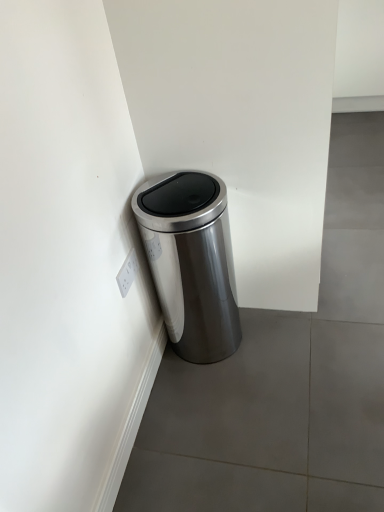
Question: Does satin silver trash can at corner have a greater width compared to white plastic electric outlet at lower left?

Choices:
 (A) no
 (B) yes

Answer: (B)

Question: Does satin silver trash can at corner have a larger size compared to white plastic electric outlet at lower left?

Choices:
 (A) no
 (B) yes

Answer: (B)

Question: Is satin silver trash can at corner positioned in front of white plastic electric outlet at lower left?

Choices:
 (A) no
 (B) yes

Answer: (B)

Question: Does satin silver trash can at corner have a smaller size compared to white plastic electric outlet at lower left?

Choices:
 (A) no
 (B) yes

Answer: (A)

Question: Can you confirm if satin silver trash can at corner is taller than white plastic electric outlet at lower left?

Choices:
 (A) yes
 (B) no

Answer: (A)

Question: From the image's perspective, is satin silver trash can at corner above white plastic electric outlet at lower left?

Choices:
 (A) no
 (B) yes

Answer: (B)

Question: Considering the relative positions of white plastic electric outlet at lower left and satin silver trash can at corner in the image provided, is white plastic electric outlet at lower left to the left of satin silver trash can at corner from the viewer's perspective?

Choices:
 (A) yes
 (B) no

Answer: (A)

Question: From a real-world perspective, is white plastic electric outlet at lower left below satin silver trash can at corner?

Choices:
 (A) no
 (B) yes

Answer: (A)

Question: Is white plastic electric outlet at lower left at the right side of satin silver trash can at corner?

Choices:
 (A) yes
 (B) no

Answer: (B)

Question: Does white plastic electric outlet at lower left have a lesser height compared to satin silver trash can at corner?

Choices:
 (A) yes
 (B) no

Answer: (A)

Question: Is white plastic electric outlet at lower left oriented away from satin silver trash can at corner?

Choices:
 (A) yes
 (B) no

Answer: (B)

Question: Does white plastic electric outlet at lower left have a larger size compared to satin silver trash can at corner?

Choices:
 (A) no
 (B) yes

Answer: (A)

Question: Based on their sizes in the image, would you say satin silver trash can at corner is bigger or smaller than white plastic electric outlet at lower left?

Choices:
 (A) small
 (B) big

Answer: (B)